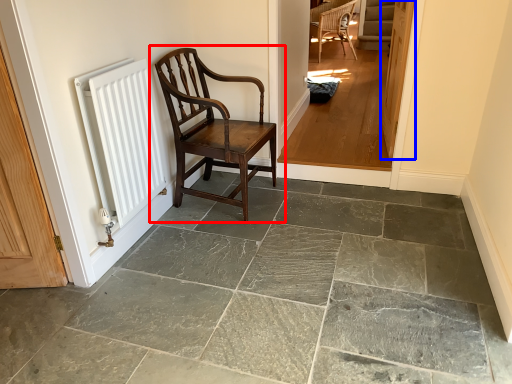
Question: Which point is closer to the camera, chair (highlighted by a red box) or door (highlighted by a blue box)?

Choices:
 (A) chair
 (B) door

Answer: (A)